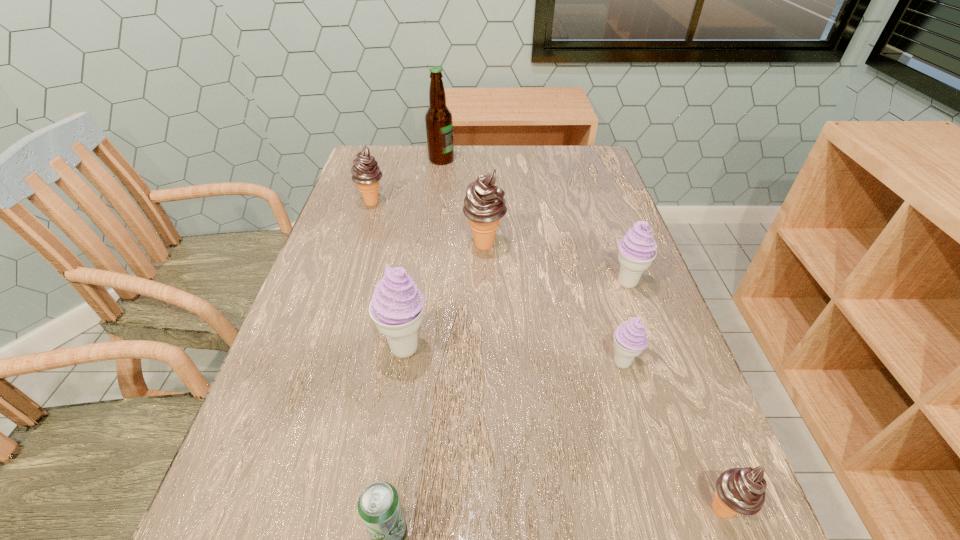
The width and height of the screenshot is (960, 540). I want to click on the smallest purple icecream, so click(630, 338).

This screenshot has width=960, height=540. Identify the location of the nearest chocolate icecream. (738, 490).

Where is `the rightmost chocolate icecream`? The height and width of the screenshot is (540, 960). the rightmost chocolate icecream is located at coordinates (738, 490).

The width and height of the screenshot is (960, 540). Identify the location of vacant region located 0.200m on the label of the farthest object. (516, 160).

At what (x,y) coordinates should I click in order to perform the action: click on free space located on the back of the second nearest chocolate icecream. Please return your answer as a coordinate pair (x, y). The width and height of the screenshot is (960, 540). Looking at the image, I should click on (484, 179).

Locate an element on the screen. vacant space located 0.110m on the right of the second icecream from left to right is located at coordinates (486, 348).

Where is `vacant region located 0.310m on the right of the farthest icecream`? vacant region located 0.310m on the right of the farthest icecream is located at coordinates (497, 202).

Identify the location of blank space located 0.220m on the back of the third farthest icecream. (604, 216).

This screenshot has width=960, height=540. Identify the location of free space located 0.400m on the back of the smallest purple icecream. (584, 227).

Where is `vacant space located 0.290m on the left of the rightmost chocolate icecream`? vacant space located 0.290m on the left of the rightmost chocolate icecream is located at coordinates (504, 509).